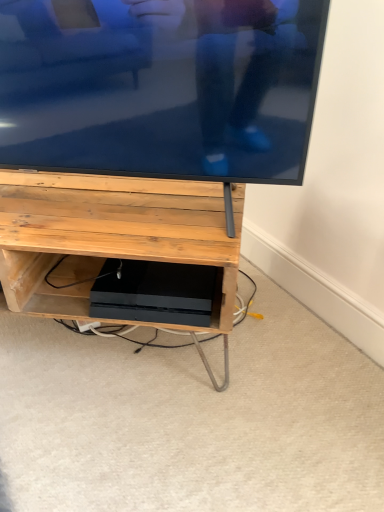
You are a GUI agent. You are given a task and a screenshot of the screen. Output one action in this format:
    pyautogui.click(x=<x>, y=<y>)
    Task: Click on the matte black tv at upper center
    The width and height of the screenshot is (384, 512).
    Given the screenshot: What is the action you would take?
    pyautogui.click(x=160, y=86)

Find the location of `black matte console at center`. black matte console at center is located at coordinates (23, 275).

Considering the sizes of objects black matte console at center and matte wood shelf at center in the image provided, who is wider, black matte console at center or matte wood shelf at center?

matte wood shelf at center is wider.

Is black matte console at center to the left of matte wood shelf at center from the viewer's perspective?

Incorrect, black matte console at center is not on the left side of matte wood shelf at center.

Is matte wood shelf at center at the back of black matte console at center?

Yes.

Consider the image. Would you say matte black tv at upper center is part of black matte console at center's contents?

No, matte black tv at upper center is not a part of black matte console at center.

Is the position of black matte console at center less distant than that of matte black tv at upper center?

No, black matte console at center is behind matte black tv at upper center.

Which point is more distant from viewer, (12, 283) or (95, 120)?

The point (12, 283) is farther.

Is black matte console at center directly adjacent to matte black tv at upper center?

black matte console at center and matte black tv at upper center are not in contact.

Does matte wood shelf at center have a lesser width compared to black matte console at center?

No, matte wood shelf at center is not thinner than black matte console at center.

From the image's perspective, is matte wood shelf at center located above black matte console at center?

Yes, from the image's perspective, matte wood shelf at center is over black matte console at center.

Considering the relative sizes of matte wood shelf at center and black matte console at center in the image provided, is matte wood shelf at center smaller than black matte console at center?

No, matte wood shelf at center is not smaller than black matte console at center.

Locate an element on the screen. furniture located above the black matte console at center (from the image's perspective) is located at coordinates (110, 236).

Considering the relative sizes of matte black tv at upper center and matte wood shelf at center in the image provided, is matte black tv at upper center thinner than matte wood shelf at center?

Indeed, matte black tv at upper center has a lesser width compared to matte wood shelf at center.

Between matte black tv at upper center and matte wood shelf at center, which one has less height?

Standing shorter between the two is matte wood shelf at center.

Is matte black tv at upper center not near matte wood shelf at center?

matte black tv at upper center is near matte wood shelf at center, not far away.

How different are the orientations of matte black tv at upper center and matte wood shelf at center in degrees?

2.96e-05 degrees separate the facing orientations of matte black tv at upper center and matte wood shelf at center.

Is matte black tv at upper center at the left side of black matte console at center?

Indeed, matte black tv at upper center is positioned on the left side of black matte console at center.

Based on the photo, which object is thinner, matte black tv at upper center or black matte console at center?

With smaller width is matte black tv at upper center.

Is matte black tv at upper center behind black matte console at center?

No, matte black tv at upper center is closer to the camera.

Is matte black tv at upper center aimed at black matte console at center?

No, matte black tv at upper center is not aimed at black matte console at center.

Between matte wood shelf at center and matte black tv at upper center, which one has larger size?

Bigger between the two is matte wood shelf at center.

Does matte wood shelf at center have a lesser width compared to matte black tv at upper center?

No, matte wood shelf at center is not thinner than matte black tv at upper center.

Is matte wood shelf at center completely or partially outside of matte black tv at upper center?

Yes, matte wood shelf at center is outside of matte black tv at upper center.

Identify the location of furniture below the black matte console at center (from a real-world perspective). (110, 236).

Where is `television above the black matte console at center (from the image's perspective)`? television above the black matte console at center (from the image's perspective) is located at coordinates (160, 86).

Based on their spatial positions, is matte black tv at upper center or matte wood shelf at center further from black matte console at center?

matte black tv at upper center is positioned further to the anchor black matte console at center.

Estimate the real-world distances between objects in this image. Which object is further from matte black tv at upper center, matte wood shelf at center or black matte console at center?

Among the two, black matte console at center is located further to matte black tv at upper center.

Considering their positions, is black matte console at center positioned closer to matte wood shelf at center than matte black tv at upper center?

black matte console at center is closer to matte wood shelf at center.

Which object lies further to the anchor point matte black tv at upper center, black matte console at center or matte wood shelf at center?

Based on the image, black matte console at center appears to be further to matte black tv at upper center.

From the image, which object appears to be farther from black matte console at center, matte wood shelf at center or matte black tv at upper center?

matte black tv at upper center is further to black matte console at center.

Looking at the image, which one is located further to matte wood shelf at center, matte black tv at upper center or black matte console at center?

Based on the image, matte black tv at upper center appears to be further to matte wood shelf at center.

In order to click on furniture between matte black tv at upper center and black matte console at center in the up-down direction in this screenshot , I will do `click(110, 236)`.